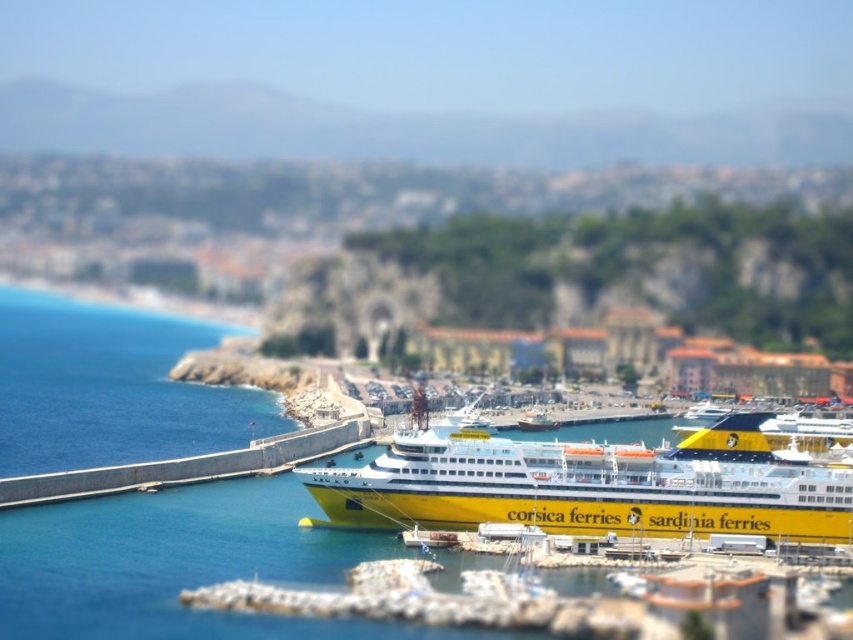
Question: Does yellow matte/clear ferry at center come in front of yellow matte ferry at center?

Choices:
 (A) no
 (B) yes

Answer: (B)

Question: Does yellow matte/clear ferry at center lie in front of concrete wall at lower left?

Choices:
 (A) yes
 (B) no

Answer: (A)

Question: Which point is farther to the camera?

Choices:
 (A) (525, 420)
 (B) (73, 493)

Answer: (A)

Question: Among these objects, which one is nearest to the camera?

Choices:
 (A) concrete wall at lower left
 (B) yellow matte/clear ferry at center

Answer: (B)

Question: Is yellow matte/clear ferry at center further to the viewer compared to concrete wall at lower left?

Choices:
 (A) yes
 (B) no

Answer: (B)

Question: Which of the following is the farthest from the observer?

Choices:
 (A) (223, 468)
 (B) (577, 490)
 (C) (525, 429)

Answer: (C)